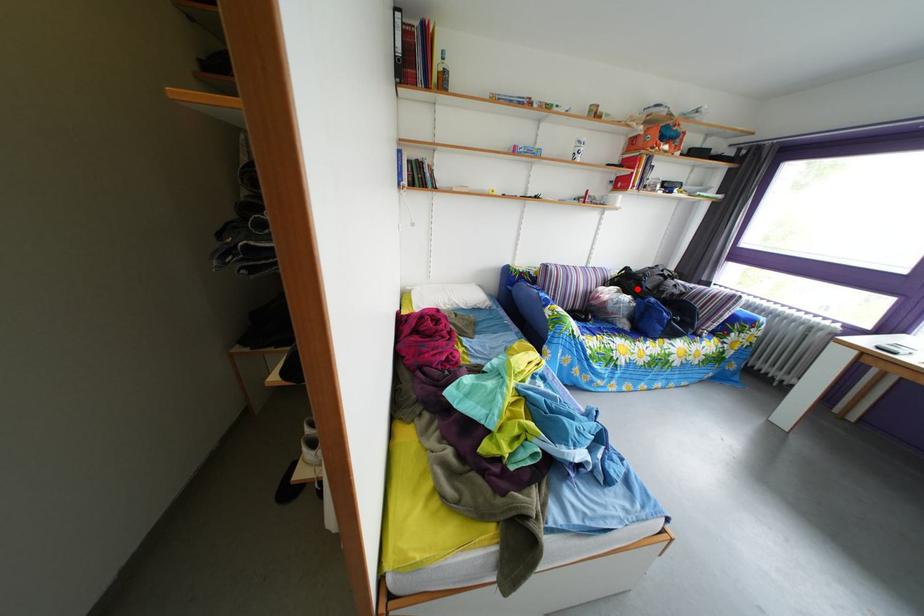
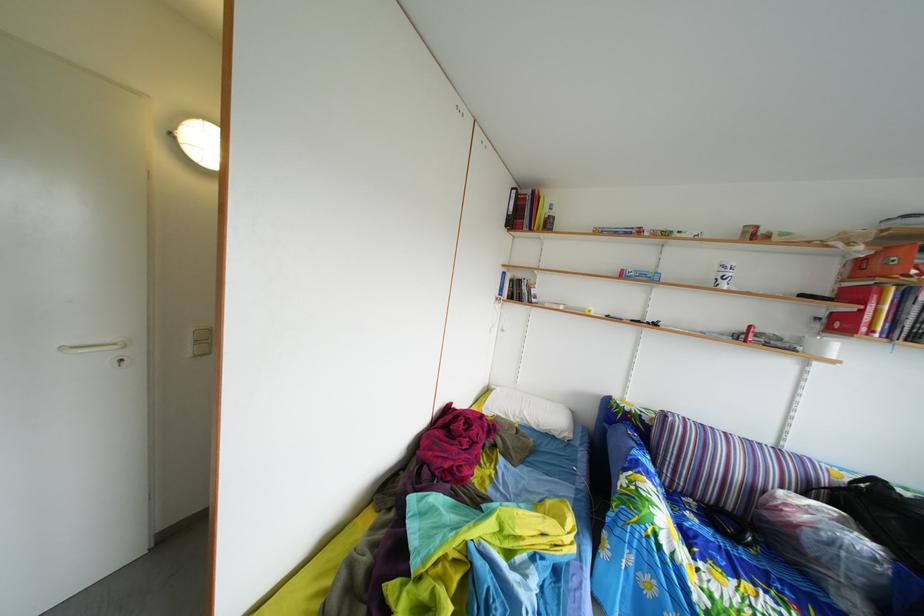
In the second image, find the point that corresponds to the highlighted location in the first image.

(886, 515)